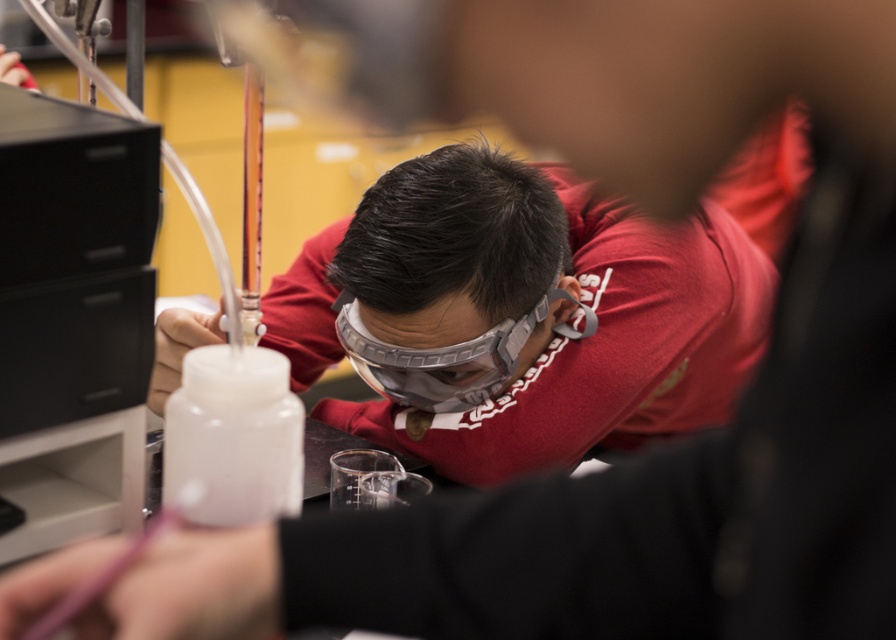
Question: Which point is closer to the camera?

Choices:
 (A) matte gray safety goggles at center
 (B) gray matte goggles at center

Answer: (A)

Question: Is matte gray safety goggles at center above gray matte goggles at center?

Choices:
 (A) no
 (B) yes

Answer: (B)

Question: Is the position of matte gray safety goggles at center more distant than that of gray matte goggles at center?

Choices:
 (A) yes
 (B) no

Answer: (B)

Question: Is matte gray safety goggles at center thinner than gray matte goggles at center?

Choices:
 (A) yes
 (B) no

Answer: (B)

Question: Which of the following is the farthest from the observer?

Choices:
 (A) matte gray safety goggles at center
 (B) gray matte goggles at center

Answer: (B)